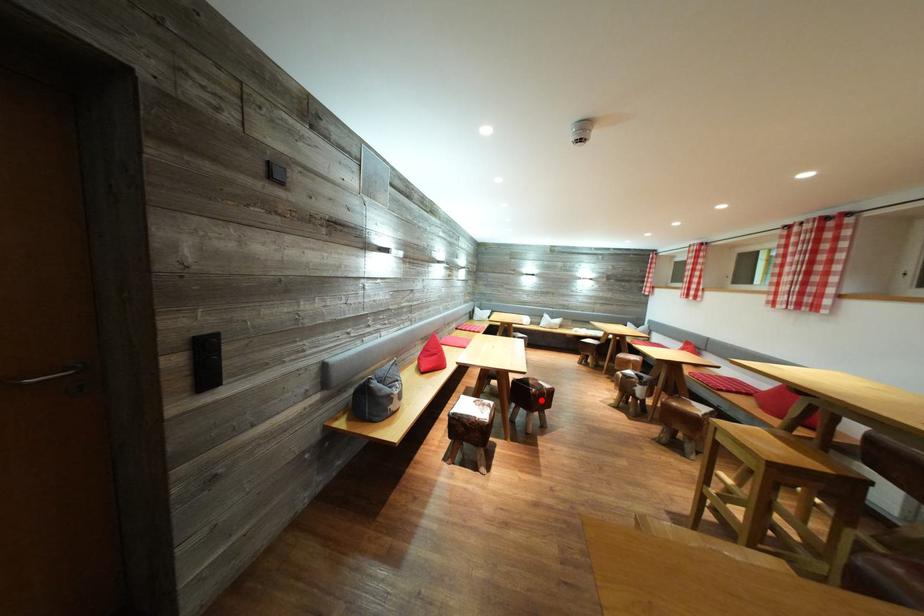
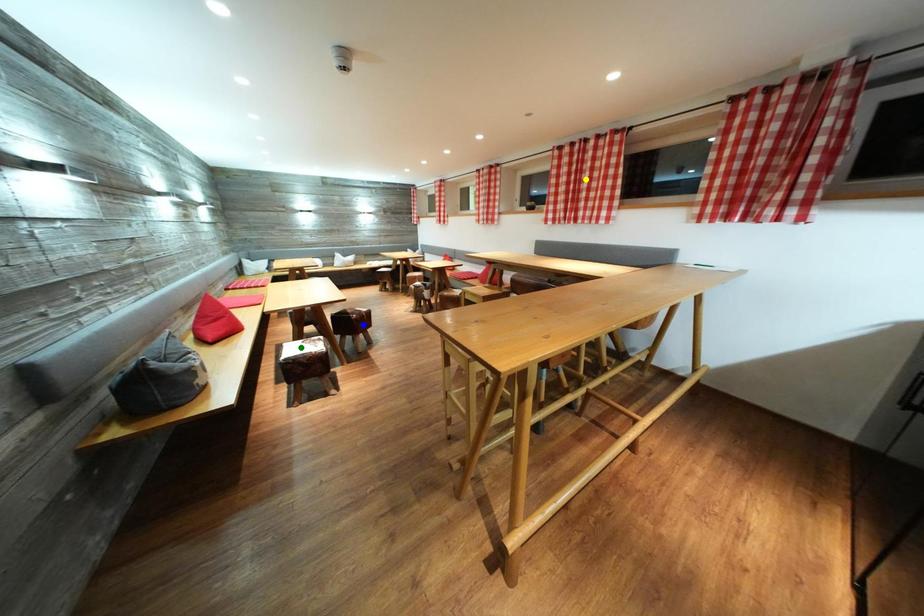
Question: I am providing you with two images of the same scene from different viewpoints. A red point is marked on the first image. You are given multiple points on the second image. Which mark in image 2 goes with the point in image 1?

Choices:
 (A) blue point
 (B) green point
 (C) yellow point

Answer: (A)